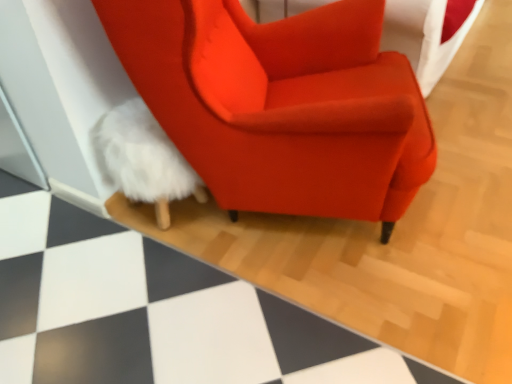
Question: From a real-world perspective, does satin orange armchair at center stand above white fluffy rug at lower left?

Choices:
 (A) yes
 (B) no

Answer: (A)

Question: Does satin orange armchair at center come in front of white fluffy rug at lower left?

Choices:
 (A) no
 (B) yes

Answer: (A)

Question: Is satin orange armchair at center shorter than white fluffy rug at lower left?

Choices:
 (A) yes
 (B) no

Answer: (B)

Question: Could you tell me if satin orange armchair at center is facing white fluffy rug at lower left?

Choices:
 (A) no
 (B) yes

Answer: (A)

Question: Can you confirm if satin orange armchair at center is bigger than white fluffy rug at lower left?

Choices:
 (A) yes
 (B) no

Answer: (A)

Question: From the image's perspective, is satin orange armchair at center over white fluffy rug at lower left?

Choices:
 (A) yes
 (B) no

Answer: (B)

Question: Is the position of white fluffy rug at lower left less distant than that of white fluffy bean bag at lower left?

Choices:
 (A) no
 (B) yes

Answer: (B)

Question: Is white fluffy rug at lower left aimed at white fluffy bean bag at lower left?

Choices:
 (A) no
 (B) yes

Answer: (A)

Question: Can you confirm if white fluffy rug at lower left is bigger than white fluffy bean bag at lower left?

Choices:
 (A) yes
 (B) no

Answer: (A)

Question: Is white fluffy rug at lower left wider than white fluffy bean bag at lower left?

Choices:
 (A) yes
 (B) no

Answer: (A)

Question: From the image's perspective, would you say white fluffy rug at lower left is shown under white fluffy bean bag at lower left?

Choices:
 (A) yes
 (B) no

Answer: (B)

Question: Would you say white fluffy rug at lower left contains white fluffy bean bag at lower left?

Choices:
 (A) yes
 (B) no

Answer: (B)

Question: Is white fluffy bean bag at lower left wider than white fluffy rug at lower left?

Choices:
 (A) yes
 (B) no

Answer: (B)